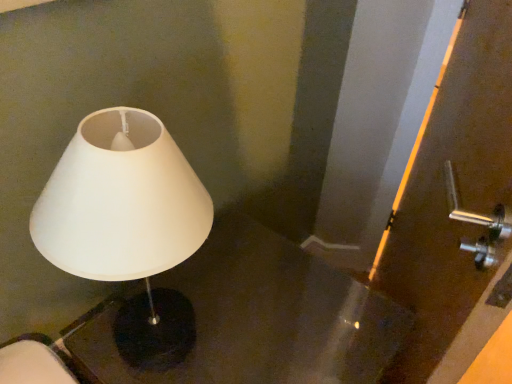
Question: From a real-world perspective, is black glossy table at left below white matte lampshade at left?

Choices:
 (A) no
 (B) yes

Answer: (B)

Question: Is black glossy table at left outside of white matte lampshade at left?

Choices:
 (A) no
 (B) yes

Answer: (B)

Question: Is black glossy table at left facing towards white matte lampshade at left?

Choices:
 (A) no
 (B) yes

Answer: (A)

Question: Does black glossy table at left appear on the right side of white matte lampshade at left?

Choices:
 (A) yes
 (B) no

Answer: (A)

Question: Does black glossy table at left have a lesser width compared to white matte lampshade at left?

Choices:
 (A) no
 (B) yes

Answer: (A)

Question: Does black glossy table at left have a larger size compared to white matte lampshade at left?

Choices:
 (A) yes
 (B) no

Answer: (A)

Question: Does white matte lampshade at left contain matte brown screen door at right?

Choices:
 (A) no
 (B) yes

Answer: (A)

Question: Is white matte lampshade at left outside of matte brown screen door at right?

Choices:
 (A) yes
 (B) no

Answer: (A)

Question: Is white matte lampshade at left bigger than matte brown screen door at right?

Choices:
 (A) yes
 (B) no

Answer: (B)

Question: Is white matte lampshade at left in front of matte brown screen door at right?

Choices:
 (A) no
 (B) yes

Answer: (B)

Question: From a real-world perspective, is white matte lampshade at left physically below matte brown screen door at right?

Choices:
 (A) yes
 (B) no

Answer: (B)

Question: From the image's perspective, is white matte lampshade at left located beneath matte brown screen door at right?

Choices:
 (A) no
 (B) yes

Answer: (B)

Question: Is white matte lampshade at left oriented away from black glossy table at left?

Choices:
 (A) no
 (B) yes

Answer: (A)